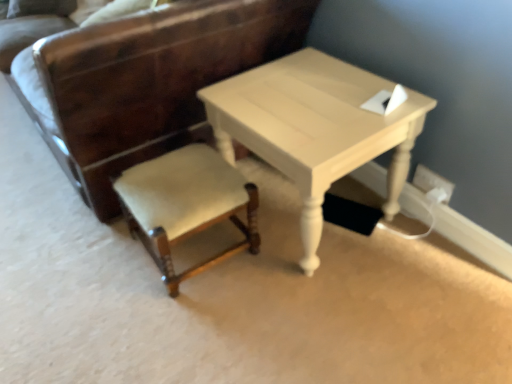
The image size is (512, 384). In order to click on vacant space in between velvet beige stool at center, the 2th chair in the top-to-bottom sequence, and light beige wood table at center in this screenshot , I will do `click(248, 291)`.